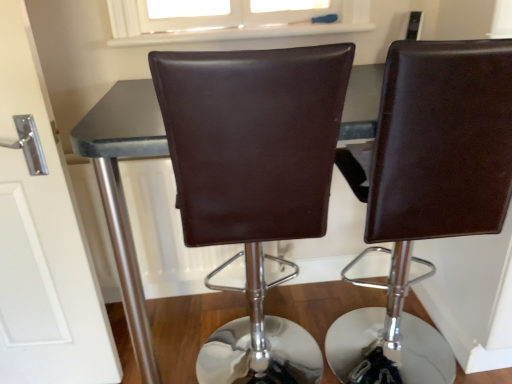
Question: Is white glossy door at left positioned beyond the bounds of matte black table at center?

Choices:
 (A) yes
 (B) no

Answer: (A)

Question: Is white glossy door at left smaller than matte black table at center?

Choices:
 (A) yes
 (B) no

Answer: (A)

Question: Is white glossy door at left positioned in front of matte black table at center?

Choices:
 (A) no
 (B) yes

Answer: (A)

Question: Is white glossy door at left touching matte black table at center?

Choices:
 (A) yes
 (B) no

Answer: (B)

Question: From a real-world perspective, does white glossy door at left stand above matte black table at center?

Choices:
 (A) yes
 (B) no

Answer: (A)

Question: Looking at their shapes, would you say brown leather chair at center, the second chair in the right-to-left sequence, is wider or thinner than brown leather chair at center, which is the 1th chair in right-to-left order?

Choices:
 (A) wide
 (B) thin

Answer: (B)

Question: From the image's perspective, is brown leather chair at center, positioned as the first chair in left-to-right order, positioned above or below brown leather chair at center, which is the 1th chair in right-to-left order?

Choices:
 (A) below
 (B) above

Answer: (A)

Question: Considering their positions, is brown leather chair at center, positioned as the first chair in left-to-right order, located in front of or behind brown leather chair at center, which is the 1th chair in right-to-left order?

Choices:
 (A) front
 (B) behind

Answer: (A)

Question: Is brown leather chair at center, the second chair in the right-to-left sequence, spatially inside brown leather chair at center, arranged as the second chair when viewed from the left, or outside of it?

Choices:
 (A) outside
 (B) inside

Answer: (A)

Question: From a real-world perspective, is matte black table at center above or below white glossy door at left?

Choices:
 (A) below
 (B) above

Answer: (A)

Question: Relative to white glossy door at left, is matte black table at center in front or behind?

Choices:
 (A) front
 (B) behind

Answer: (A)

Question: In terms of height, does matte black table at center look taller or shorter compared to white glossy door at left?

Choices:
 (A) tall
 (B) short

Answer: (B)

Question: Considering the positions of point (125, 261) and point (71, 256), is point (125, 261) closer or farther from the camera than point (71, 256)?

Choices:
 (A) farther
 (B) closer

Answer: (B)

Question: From a real-world perspective, is matte black table at center positioned above or below brown leather chair at center, arranged as the second chair when viewed from the left?

Choices:
 (A) above
 (B) below

Answer: (B)

Question: Is point (148, 142) closer or farther from the camera than point (441, 236)?

Choices:
 (A) closer
 (B) farther

Answer: (A)